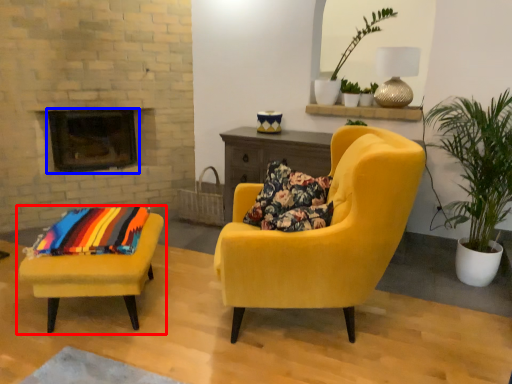
Question: Which object appears farthest to the camera in this image, chair (highlighted by a red box) or fireplace (highlighted by a blue box)?

Choices:
 (A) chair
 (B) fireplace

Answer: (B)